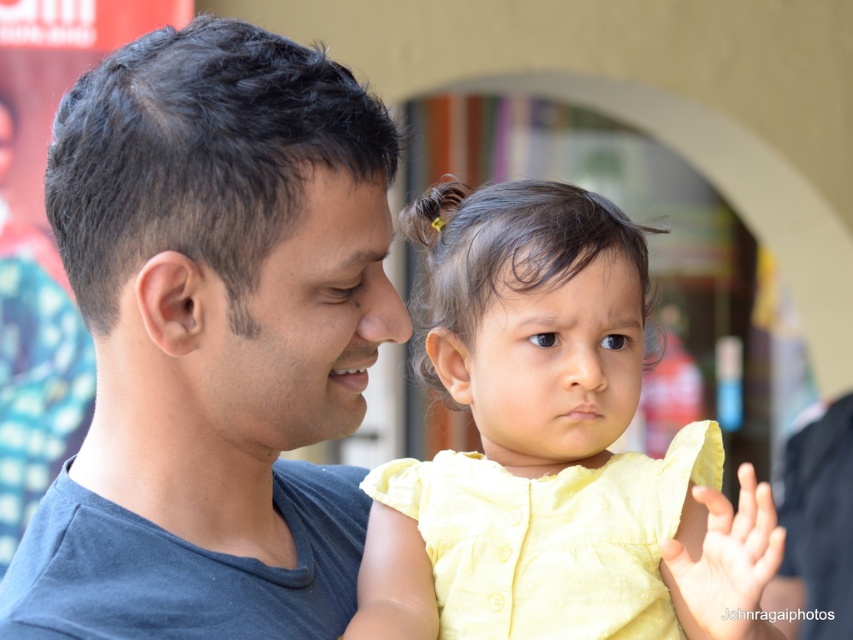
In the scene, there is a matte gray shirt at left and a yellow cotton dress at center. Which of these two items is positioned more to the left side of the image?

The matte gray shirt at left is positioned more to the left side of the image than the yellow cotton dress at center.

You are an observer looking at the scene. You notice the matte gray shirt at left and the dark brown hair at center. Which object is positioned lower in the image?

The matte gray shirt at left is positioned below the dark brown hair at center, so it is lower in the image.

You are standing in front of the image and want to touch the matte gray shirt at left before touching the dark brown hair at center. Which object should you reach for first?

You should first reach for the matte gray shirt at left because it is closer to you than the dark brown hair at center.